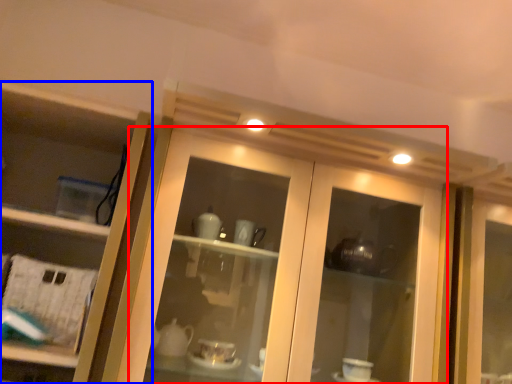
Question: Which point is closer to the camera, door (highlighted by a red box) or cupboard (highlighted by a blue box)?

Choices:
 (A) door
 (B) cupboard

Answer: (A)